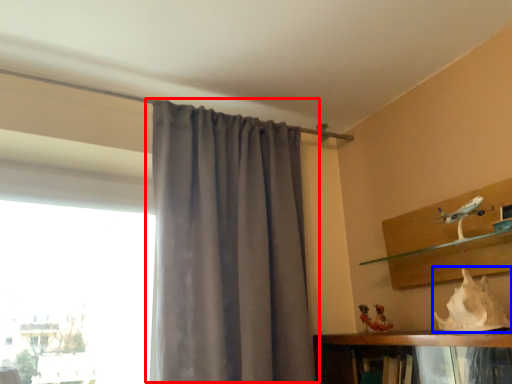
Question: Which object appears closest to the camera in this image, curtain (highlighted by a red box) or animal (highlighted by a blue box)?

Choices:
 (A) curtain
 (B) animal

Answer: (B)